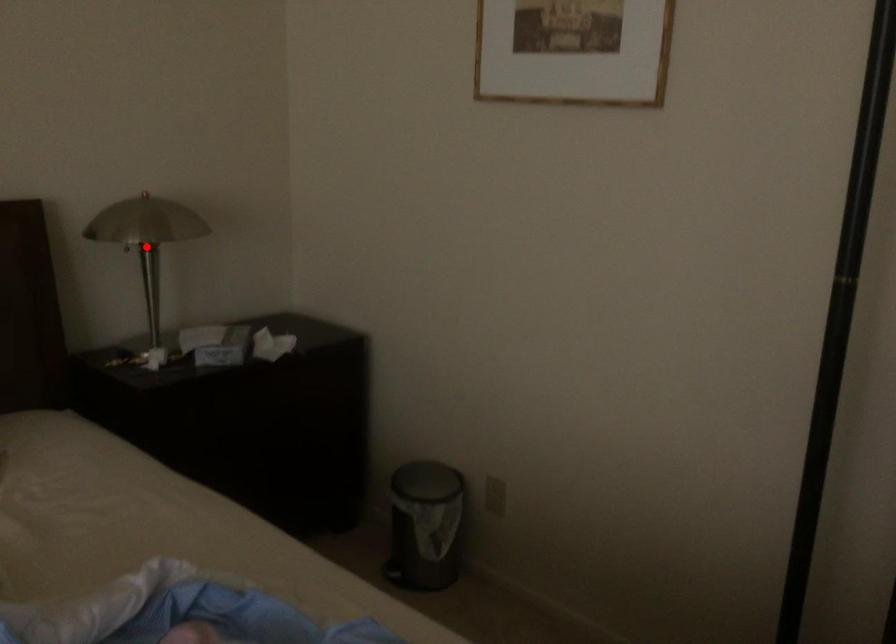
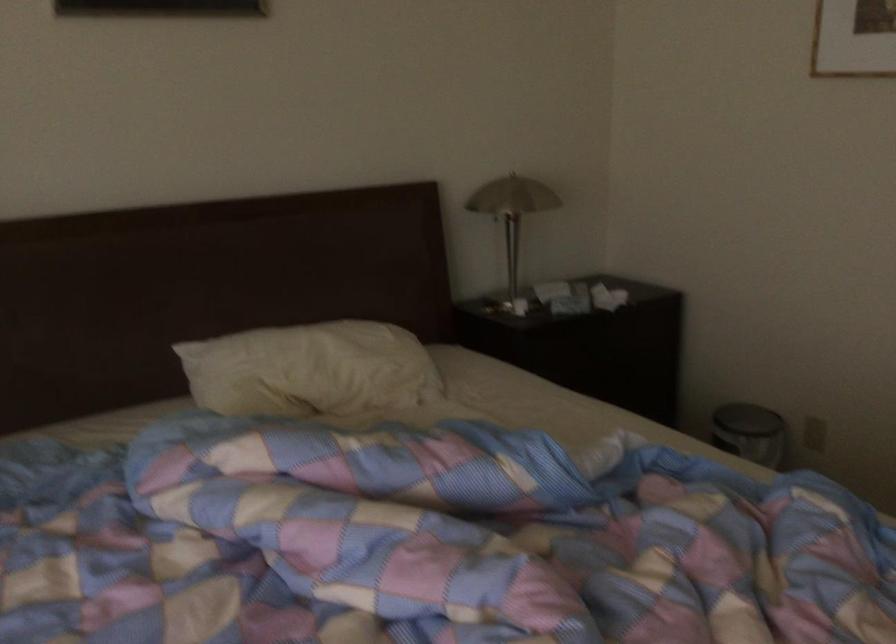
In the second image, find the point that corresponds to the highlighted location in the first image.

(512, 213)